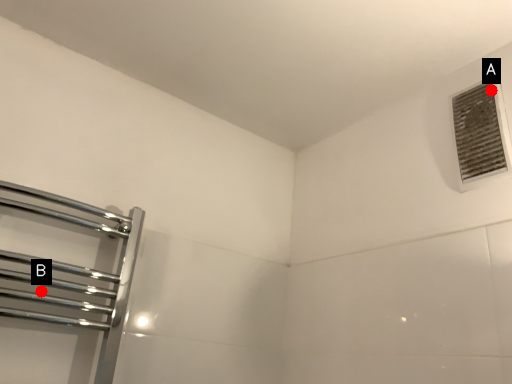
Question: Two points are circled on the image, labeled by A and B beside each circle. Which point appears farthest from the camera in this image?

Choices:
 (A) A is further
 (B) B is further

Answer: (A)